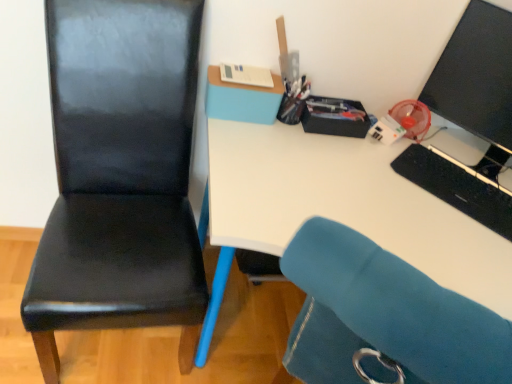
Identify the location of free space in front of black glossy monitor at upper right. This screenshot has width=512, height=384. (449, 190).